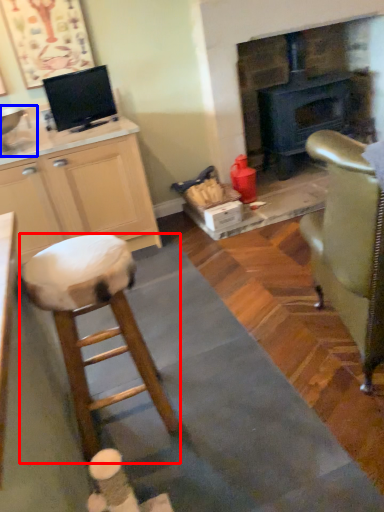
Question: Which object appears farthest to the camera in this image, stool (highlighted by a red box) or sink (highlighted by a blue box)?

Choices:
 (A) stool
 (B) sink

Answer: (B)